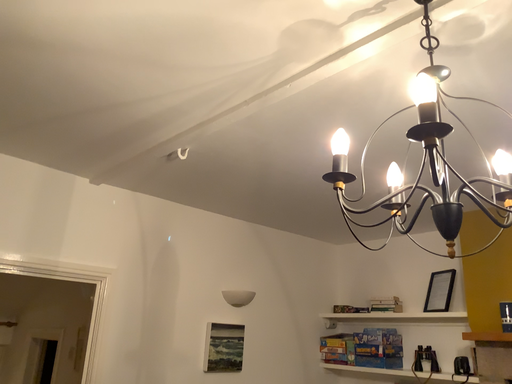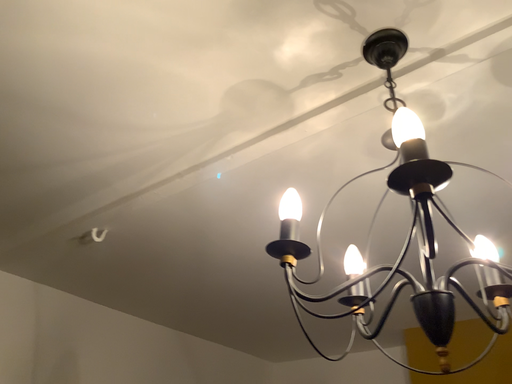
Question: How did the camera likely rotate when shooting the video?

Choices:
 (A) rotated left
 (B) rotated right

Answer: (B)